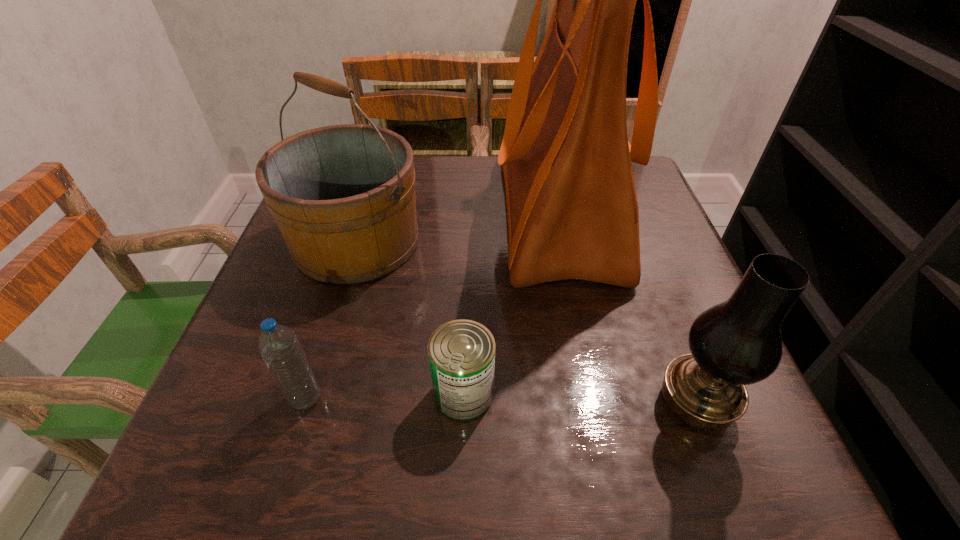
Locate an element on the screen. blank area located on the back of the third shortest object is located at coordinates (646, 274).

Identify the location of vacant area located on the back of the fourth tallest object. (342, 282).

Find the location of `vacant space located 0.160m on the back of the third object from right to left`. vacant space located 0.160m on the back of the third object from right to left is located at coordinates (467, 297).

Locate an element on the screen. The image size is (960, 540). shopping bag at the far edge is located at coordinates (572, 209).

You are a GUI agent. You are given a task and a screenshot of the screen. Output one action in this format:
    pyautogui.click(x=<x>, y=<y>)
    Task: Click on the bucket at the far edge
    This screenshot has width=960, height=540.
    Given the screenshot: What is the action you would take?
    pyautogui.click(x=343, y=196)

I want to click on object that is positioned at the near edge, so click(x=738, y=342).

The image size is (960, 540). Identify the location of bucket located at the left edge. (343, 196).

Image resolution: width=960 pixels, height=540 pixels. I want to click on water bottle at the left edge, so click(x=278, y=345).

In order to click on shopping bag that is at the right edge in this screenshot , I will do `click(572, 209)`.

At what (x,y) coordinates should I click in order to perform the action: click on oil lamp that is at the right edge. Please return your answer as a coordinate pair (x, y). Looking at the image, I should click on (738, 342).